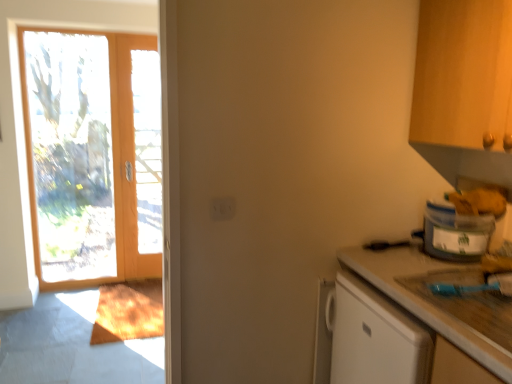
Question: Can you confirm if matte wooden screen door at left is shorter than translucent plastic container at right?

Choices:
 (A) yes
 (B) no

Answer: (B)

Question: From the image's perspective, does matte wooden screen door at left appear higher than translucent plastic container at right?

Choices:
 (A) no
 (B) yes

Answer: (B)

Question: From the image's perspective, is matte wooden screen door at left below translucent plastic container at right?

Choices:
 (A) yes
 (B) no

Answer: (B)

Question: From a real-world perspective, is matte wooden screen door at left on top of translucent plastic container at right?

Choices:
 (A) yes
 (B) no

Answer: (A)

Question: Can we say matte wooden screen door at left lies outside translucent plastic container at right?

Choices:
 (A) yes
 (B) no

Answer: (A)

Question: From a real-world perspective, is smooth beige countertop at lower right physically located above or below matte wooden screen door at left?

Choices:
 (A) above
 (B) below

Answer: (B)

Question: Do you think smooth beige countertop at lower right is within matte wooden screen door at left, or outside of it?

Choices:
 (A) inside
 (B) outside

Answer: (B)

Question: Does point (468, 340) appear closer or farther from the camera than point (131, 64)?

Choices:
 (A) farther
 (B) closer

Answer: (B)

Question: In the image, is smooth beige countertop at lower right positioned in front of or behind matte wooden screen door at left?

Choices:
 (A) behind
 (B) front

Answer: (B)

Question: Is translucent plastic container at right wider or thinner than smooth beige countertop at lower right?

Choices:
 (A) thin
 (B) wide

Answer: (A)

Question: From the image's perspective, is translucent plastic container at right located above or below smooth beige countertop at lower right?

Choices:
 (A) below
 (B) above

Answer: (B)

Question: Is translucent plastic container at right situated inside smooth beige countertop at lower right or outside?

Choices:
 (A) outside
 (B) inside

Answer: (A)

Question: Considering the positions of translucent plastic container at right and smooth beige countertop at lower right in the image, is translucent plastic container at right bigger or smaller than smooth beige countertop at lower right?

Choices:
 (A) small
 (B) big

Answer: (A)

Question: Relative to smooth beige countertop at lower right, is matte wooden screen door at left in front or behind?

Choices:
 (A) front
 (B) behind

Answer: (B)

Question: From their relative heights in the image, would you say matte wooden screen door at left is taller or shorter than smooth beige countertop at lower right?

Choices:
 (A) short
 (B) tall

Answer: (B)